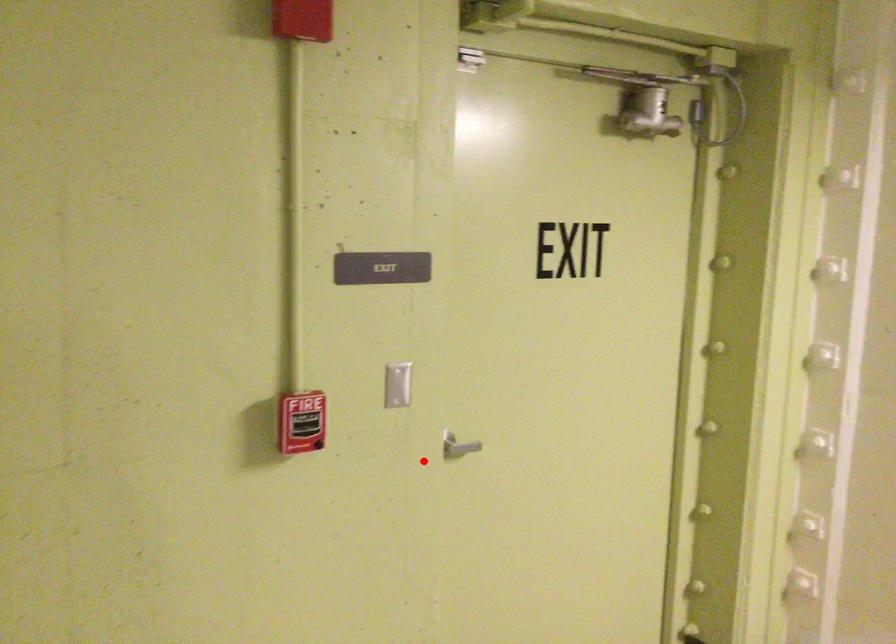
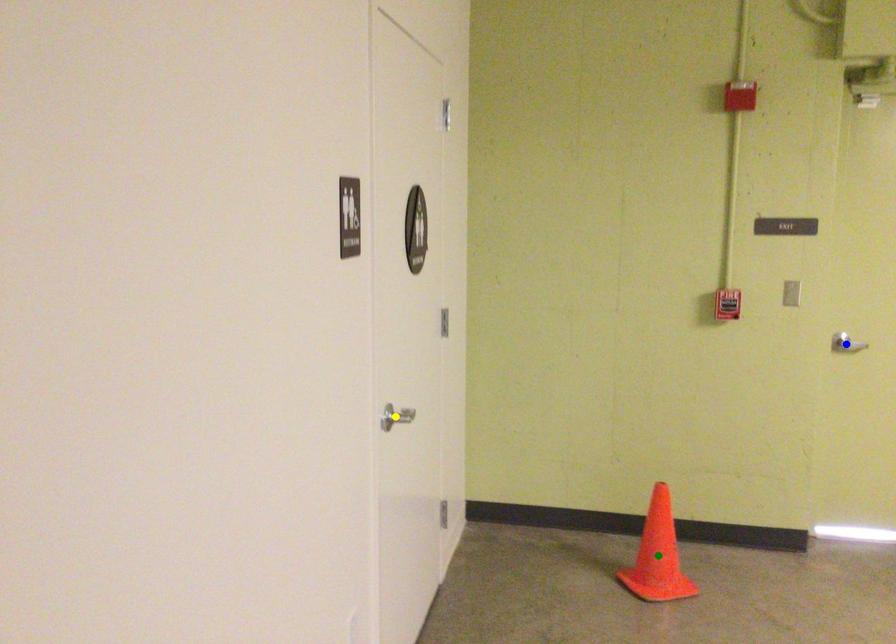
Question: I am providing you with two images of the same scene from different viewpoints. A red point is marked on the first image. You are given multiple points on the second image. Which spot in image 2 lines up with the point in image 1?

Choices:
 (A) green point
 (B) blue point
 (C) yellow point

Answer: (B)